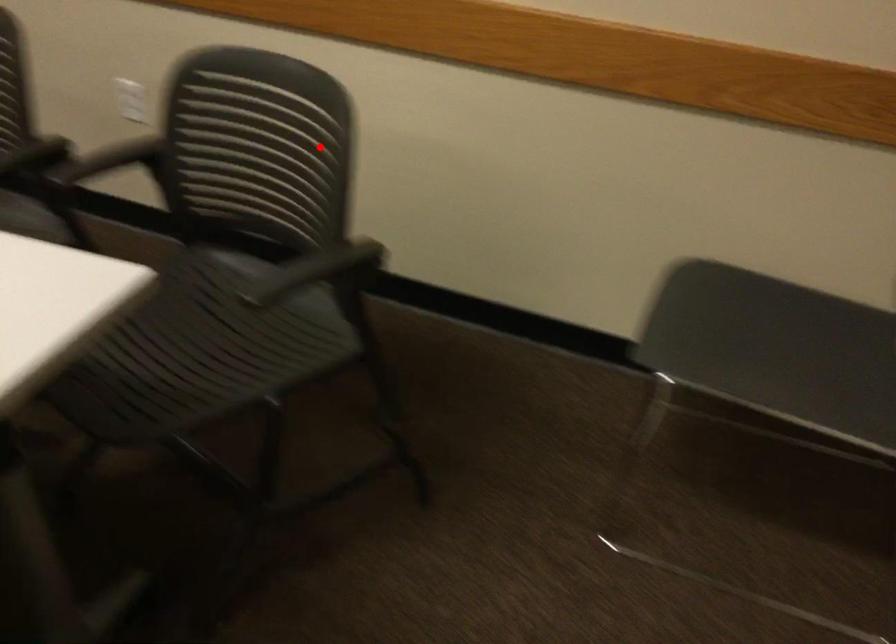
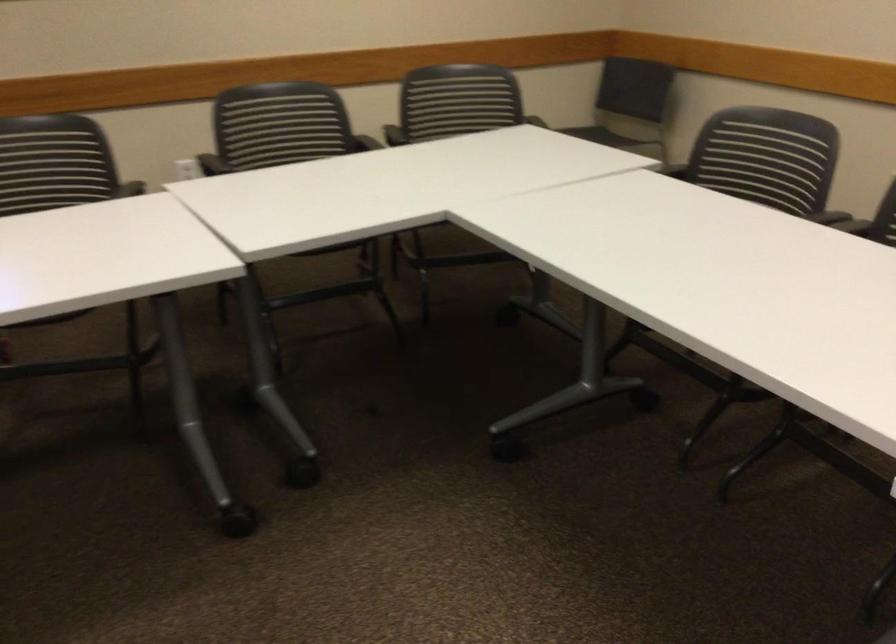
In the second image, find the point that corresponds to the highlighted location in the first image.

(455, 100)